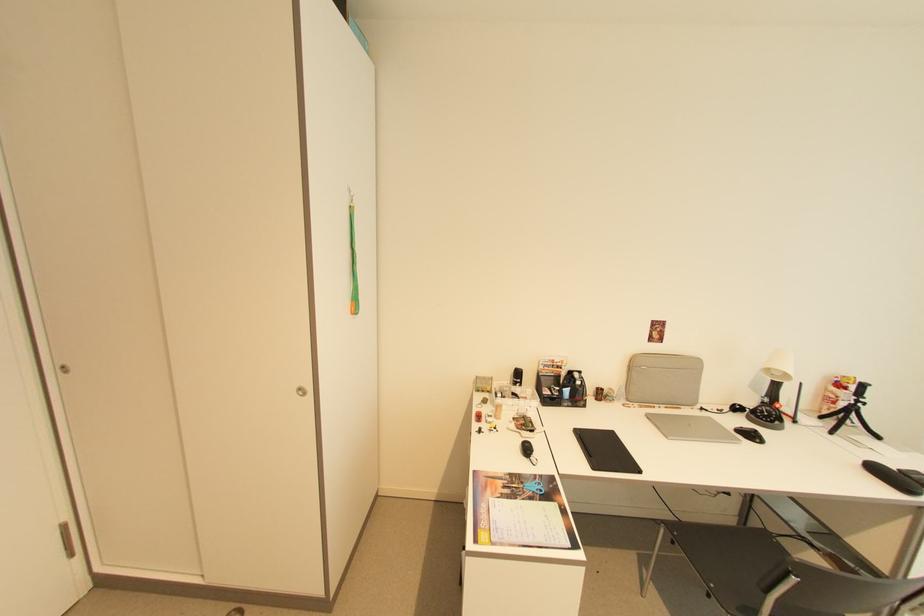
At what (x,y) coordinates should I click in order to perform the action: click on chair sitting surface. Please return your answer as a coordinate pair (x, y). Looking at the image, I should click on (728, 552).